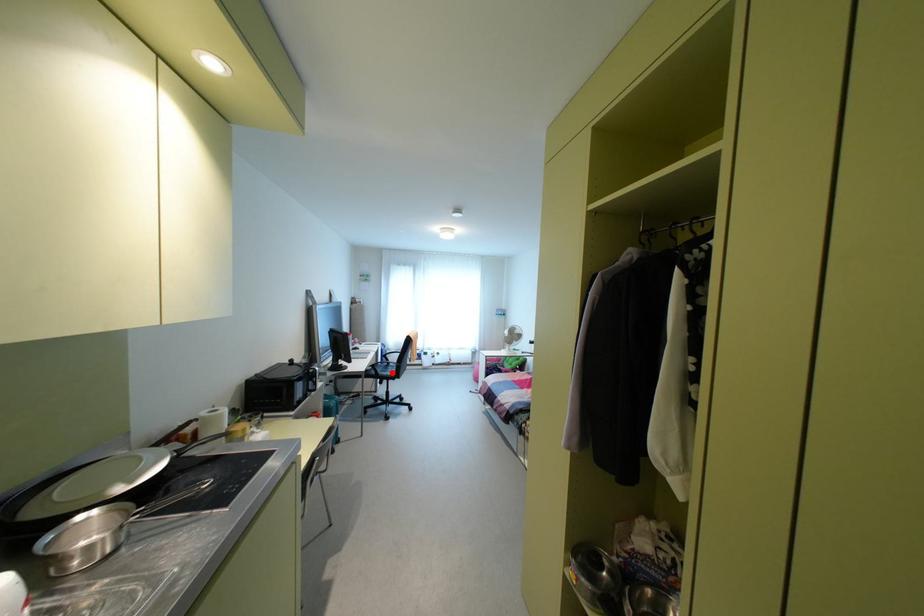
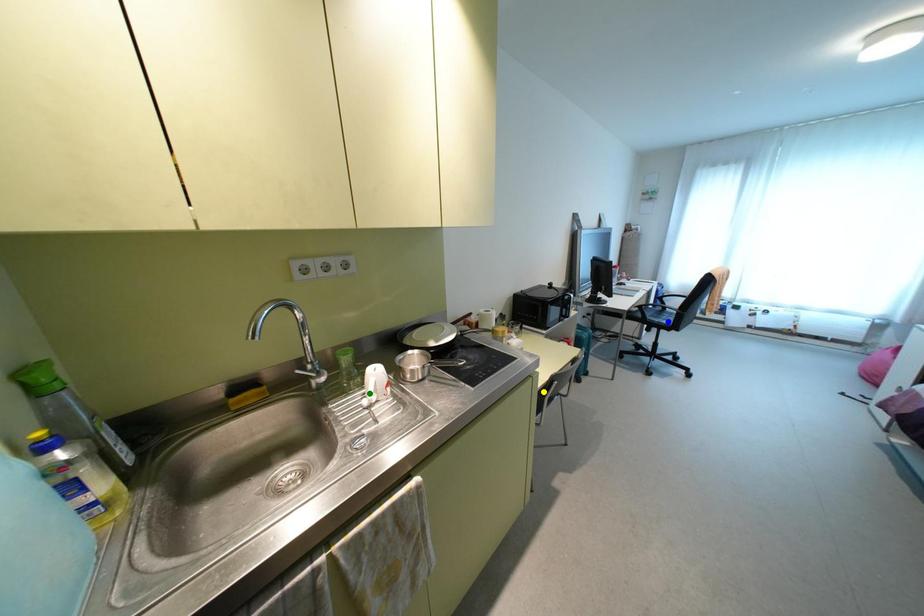
Question: I am providing you with two images of the same scene from different viewpoints. A red point is marked on the first image. You are given multiple points on the second image. Can you choose the point in image 2 that corresponds to the point in image 1?

Choices:
 (A) green point
 (B) yellow point
 (C) blue point

Answer: (C)